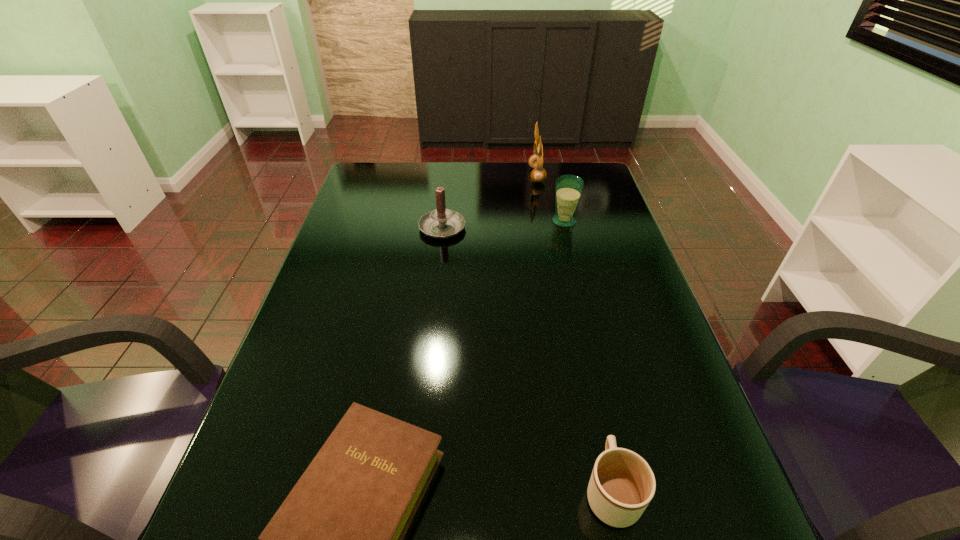
In the image, there is a desktop. Where is `blank space at the far left corner`? blank space at the far left corner is located at coordinates (397, 180).

Identify the location of vacant space that's between the farthest object and the candle. (490, 200).

Find the location of a particular element. empty space that is in between the second shortest object and the glass is located at coordinates (588, 356).

You are a GUI agent. You are given a task and a screenshot of the screen. Output one action in this format:
    pyautogui.click(x=<x>, y=<y>)
    Task: Click on the vacant region between the candle and the glass
    The width and height of the screenshot is (960, 540).
    Given the screenshot: What is the action you would take?
    pyautogui.click(x=503, y=224)

Identify the location of empty space between the second shortest object and the candle. (527, 359).

The width and height of the screenshot is (960, 540). I want to click on empty space that is in between the candle and the farthest object, so click(490, 200).

Locate an element on the screen. free space between the second shortest object and the farthest object is located at coordinates (574, 333).

You are a GUI agent. You are given a task and a screenshot of the screen. Output one action in this format:
    pyautogui.click(x=<x>, y=<y>)
    Task: Click on the free point between the tallest object and the second shortest object
    This screenshot has width=960, height=540.
    Given the screenshot: What is the action you would take?
    pyautogui.click(x=574, y=333)

Identify which object is the second nearest to the earphone. Please provide its 2D coordinates. Your answer should be formatted as a tuple, i.e. [(x, y)], where the tuple contains the x and y coordinates of a point satisfying the conditions above.

[(441, 223)]

Locate which object ranks fourth in proximity to the candle. Please provide its 2D coordinates. Your answer should be formatted as a tuple, i.e. [(x, y)], where the tuple contains the x and y coordinates of a point satisfying the conditions above.

[(622, 484)]